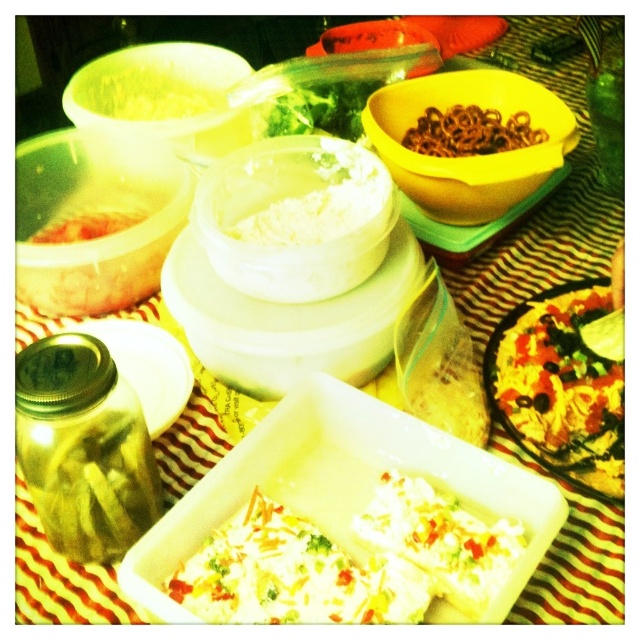
What is located at the point with coordinates (560, 385)?

The point at coordinates (560, 385) indicates a tomato sauce pizza at right.